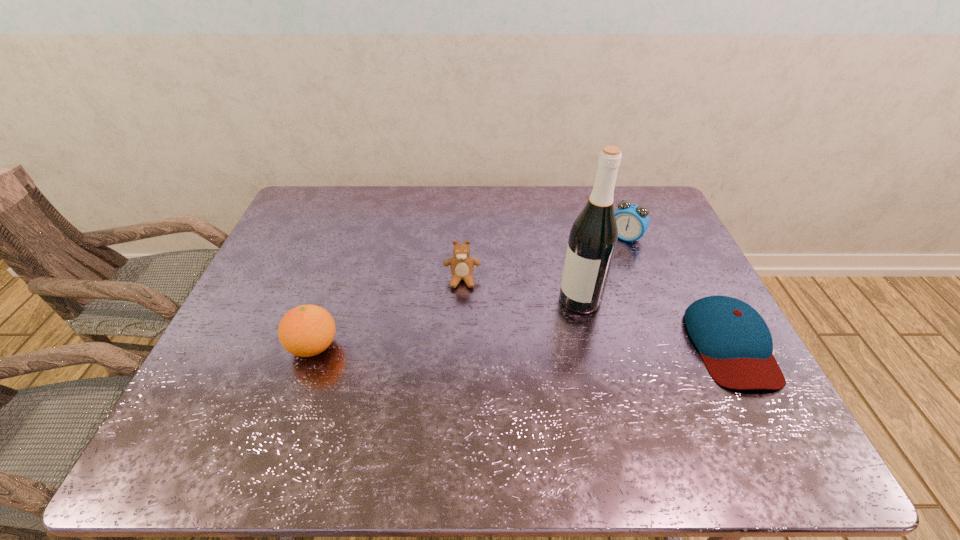
You are a GUI agent. You are given a task and a screenshot of the screen. Output one action in this format:
    pyautogui.click(x=<x>, y=<y>)
    Task: Click on the alarm clock located at the right edge
    
    Given the screenshot: What is the action you would take?
    pyautogui.click(x=633, y=220)

At what (x,y) coordinates should I click in order to perform the action: click on object that is at the near right corner. Please return your answer as a coordinate pair (x, y). Image resolution: width=960 pixels, height=540 pixels. Looking at the image, I should click on (735, 343).

Where is `vacant space at the far edge of the desktop`? The height and width of the screenshot is (540, 960). vacant space at the far edge of the desktop is located at coordinates (486, 213).

In the image, there is a desktop. Identify the location of vacant space at the near edge. (360, 404).

Where is `vacant space at the left edge of the desktop`? This screenshot has width=960, height=540. vacant space at the left edge of the desktop is located at coordinates (279, 308).

Where is `free region at the right edge of the desktop`? free region at the right edge of the desktop is located at coordinates (672, 262).

Where is `vacant space at the far left corner of the desktop`? The image size is (960, 540). vacant space at the far left corner of the desktop is located at coordinates (324, 205).

Locate an element on the screen. This screenshot has width=960, height=540. vacant area at the near left corner is located at coordinates (253, 413).

This screenshot has height=540, width=960. What are the coordinates of `vacant area between the farthest object and the shortest object` in the screenshot? It's located at (678, 291).

This screenshot has height=540, width=960. I want to click on vacant space that is in between the alarm clock and the baseball cap, so click(678, 291).